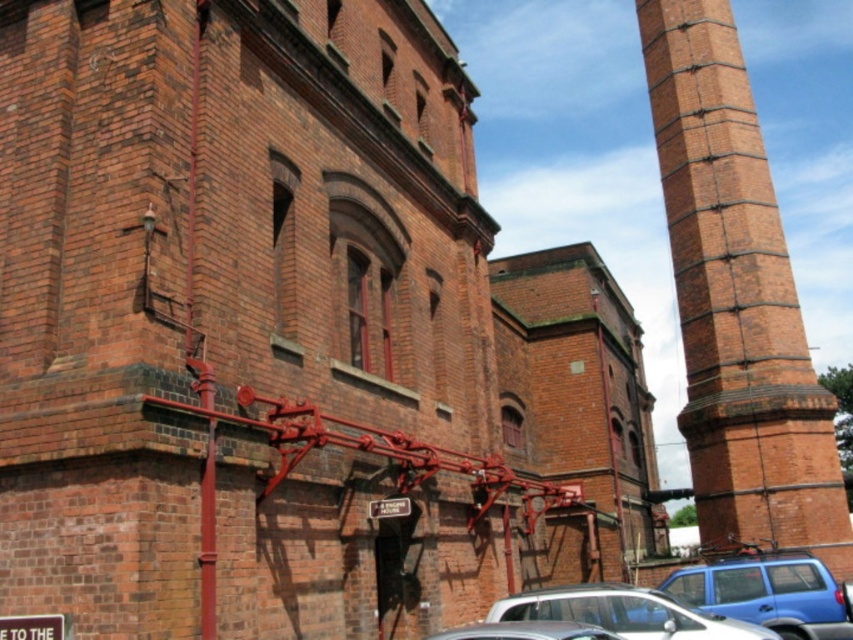
Question: Can you confirm if brick tower at right is bigger than blue matte car at lower right?

Choices:
 (A) no
 (B) yes

Answer: (B)

Question: Estimate the real-world distances between objects in this image. Which object is farther from the silver metallic car at lower center?

Choices:
 (A) blue matte car at lower right
 (B) brick tower at right

Answer: (B)

Question: Can you confirm if brick tower at right is thinner than silver metallic car at lower center?

Choices:
 (A) no
 (B) yes

Answer: (B)

Question: Which point is farther to the camera?

Choices:
 (A) (561, 605)
 (B) (741, 90)

Answer: (B)

Question: Which object is the closest to the blue matte car at lower right?

Choices:
 (A) brick tower at right
 (B) silver metallic car at lower center

Answer: (B)

Question: Can you confirm if brick tower at right is positioned to the left of silver metallic car at lower center?

Choices:
 (A) yes
 (B) no

Answer: (B)